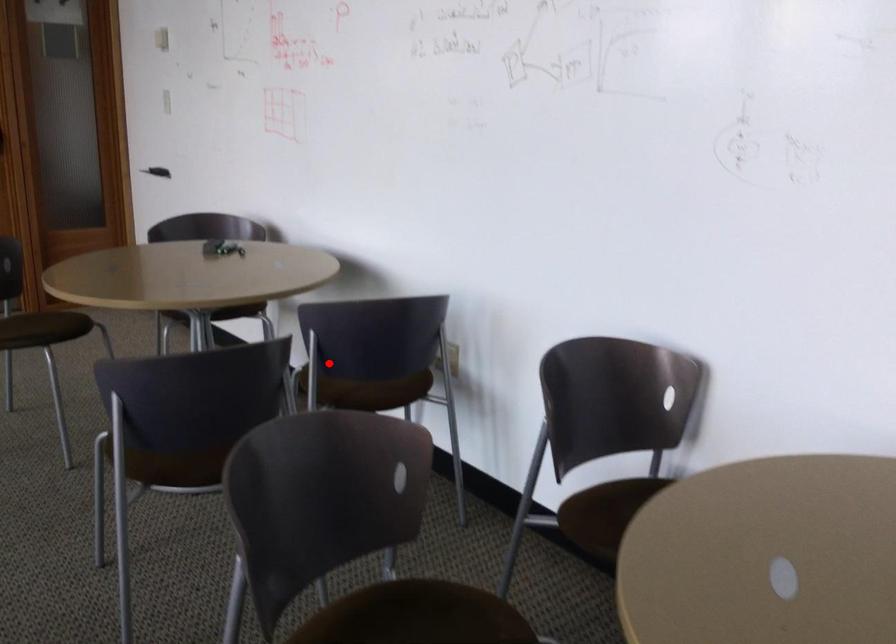
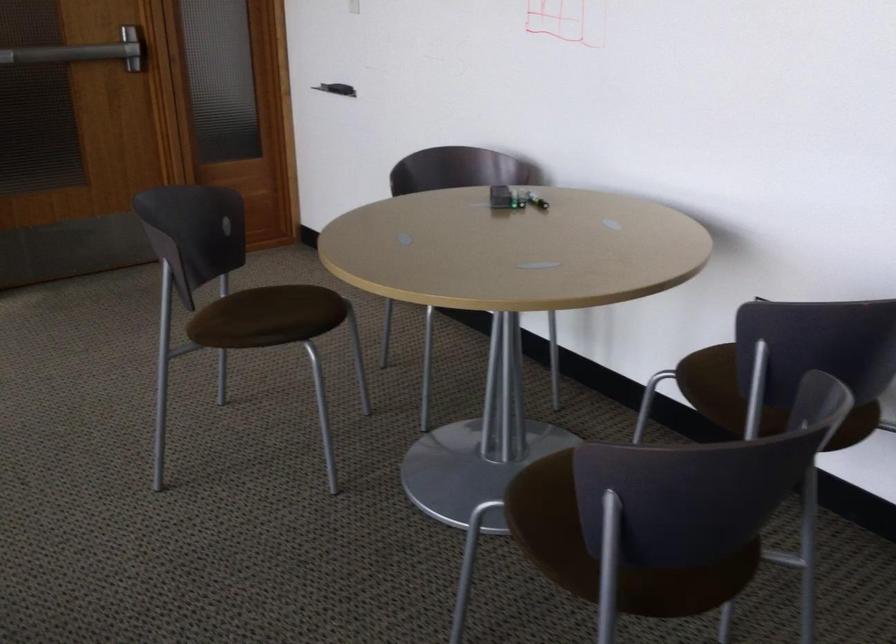
Question: I am providing you with two images of the same scene from different viewpoints. A red point is shown in image1. For the corresponding object point in image2, is it positioned nearer or farther from the camera?

Choices:
 (A) Nearer
 (B) Farther

Answer: (A)